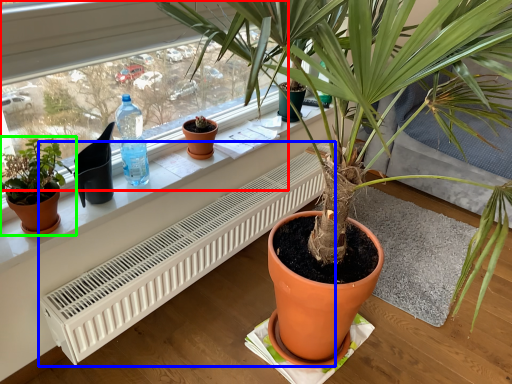
Question: Which object is positioned closest to bay window (highlighted by a red box)? Select from air conditioner (highlighted by a blue box) and houseplant (highlighted by a green box).

Choices:
 (A) air conditioner
 (B) houseplant

Answer: (A)